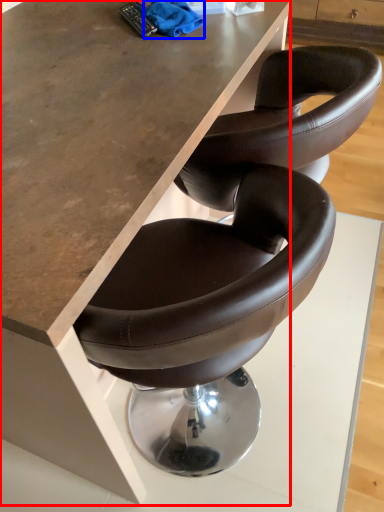
Question: Among these objects, which one is farthest to the camera, table (highlighted by a red box) or material (highlighted by a blue box)?

Choices:
 (A) table
 (B) material

Answer: (B)